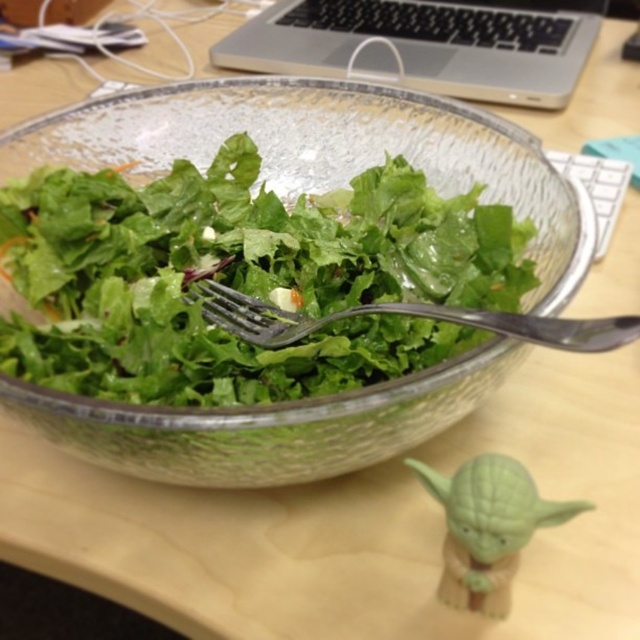
Can you confirm if green leafy salad at center is shorter than satin silver fork at center?

No, green leafy salad at center is not shorter than satin silver fork at center.

What do you see at coordinates (243, 278) in the screenshot?
I see `green leafy salad at center` at bounding box center [243, 278].

Find the location of a particular element. The height and width of the screenshot is (640, 640). green leafy salad at center is located at coordinates (243, 278).

The image size is (640, 640). In order to click on green leafy salad at center in this screenshot , I will do `click(243, 278)`.

Who is higher up, green leafy salad at center or silver metallic laptop at upper center?

silver metallic laptop at upper center

Does green leafy salad at center have a lesser height compared to silver metallic laptop at upper center?

Correct, green leafy salad at center is not as tall as silver metallic laptop at upper center.

Who is more forward, (64, 348) or (586, 4)?

Point (64, 348) is in front.

At what (x,y) coordinates should I click in order to perform the action: click on green leafy salad at center. Please return your answer as a coordinate pair (x, y). Looking at the image, I should click on (243, 278).

Which of these two, silver metallic laptop at upper center or satin silver fork at center, stands shorter?

satin silver fork at center is shorter.

Who is more distant from viewer, [444,84] or [512,336]?

The point [444,84] is more distant.

Is point (461, 44) positioned after point (257, 323)?

That is True.

The width and height of the screenshot is (640, 640). In order to click on silver metallic laptop at upper center in this screenshot , I will do `click(428, 44)`.